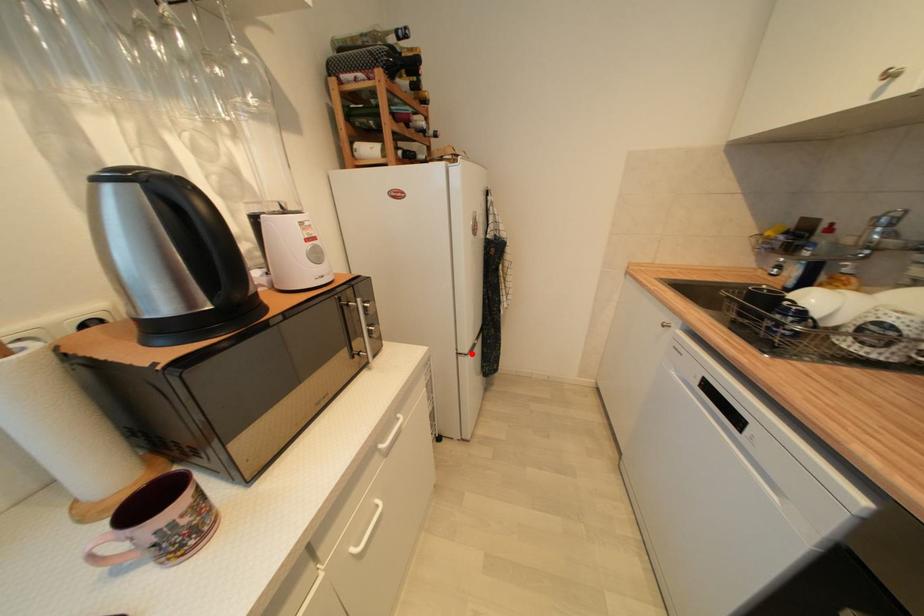
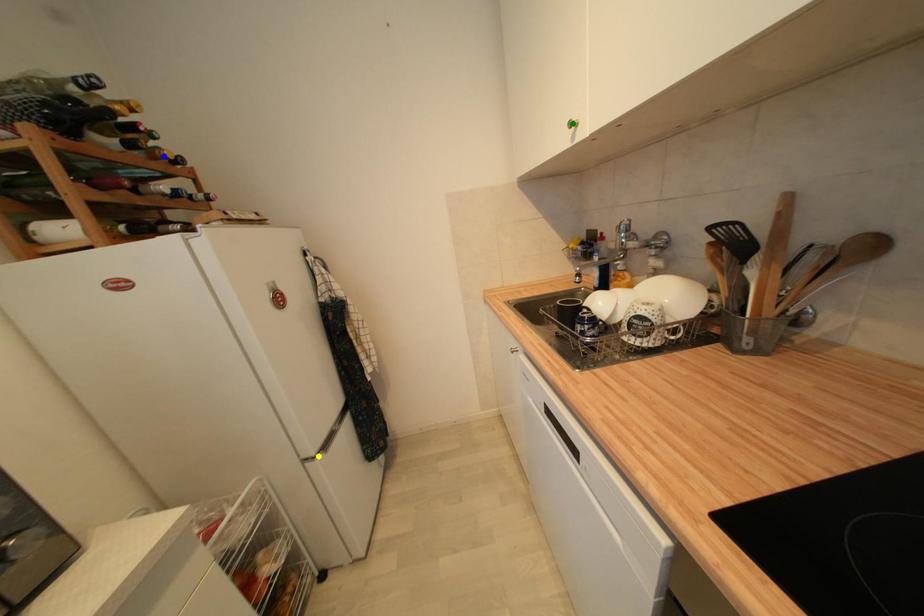
Question: I am providing you with two images of the same scene from different viewpoints. A red point is marked on the first image. You are given multiple points on the second image. Which spot in image 2 lines up with the point in image 1?

Choices:
 (A) yellow point
 (B) green point
 (C) blue point

Answer: (A)